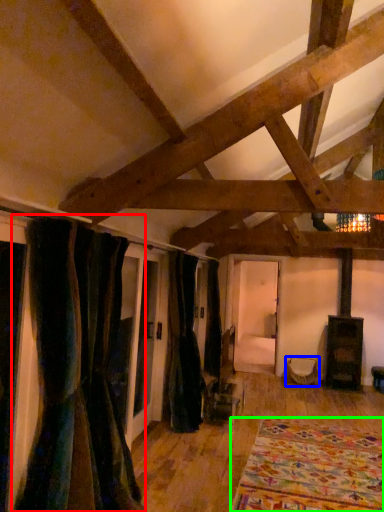
Question: Which object is positioned closest to curtain (highlighted by a red box)? Select from furniture (highlighted by a blue box) and blanket (highlighted by a green box).

Choices:
 (A) furniture
 (B) blanket

Answer: (B)